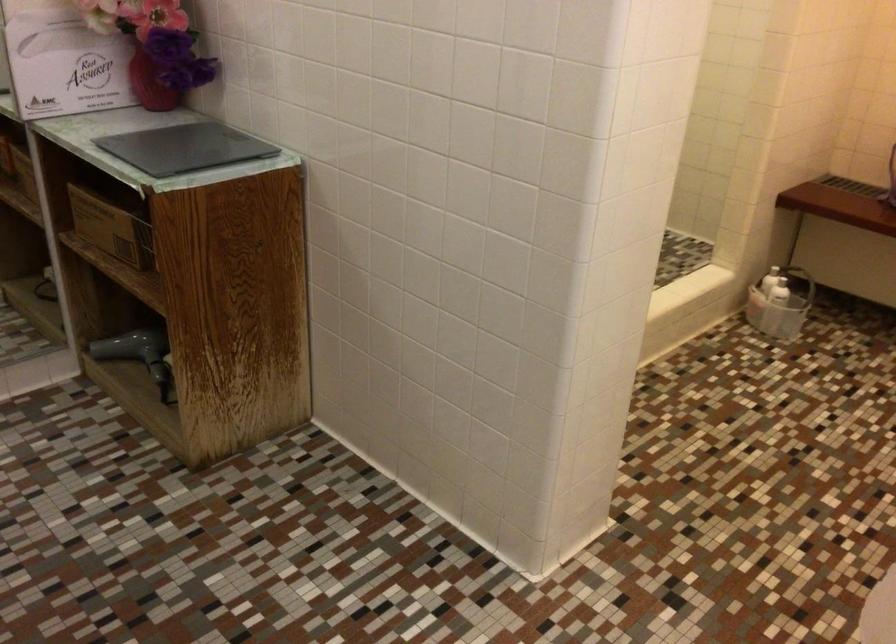
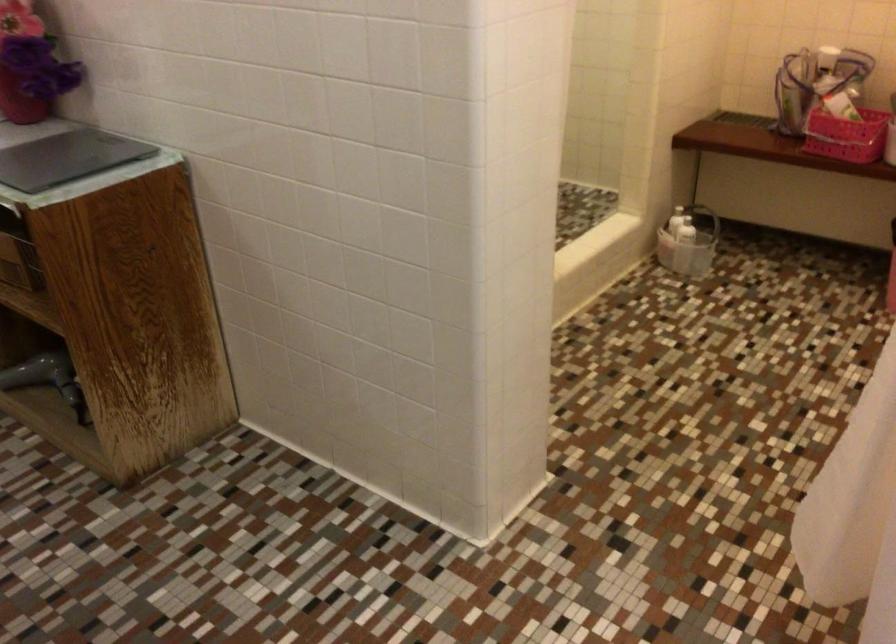
Where in the second image is the point corresponding to (x=138, y=353) from the first image?

(47, 379)